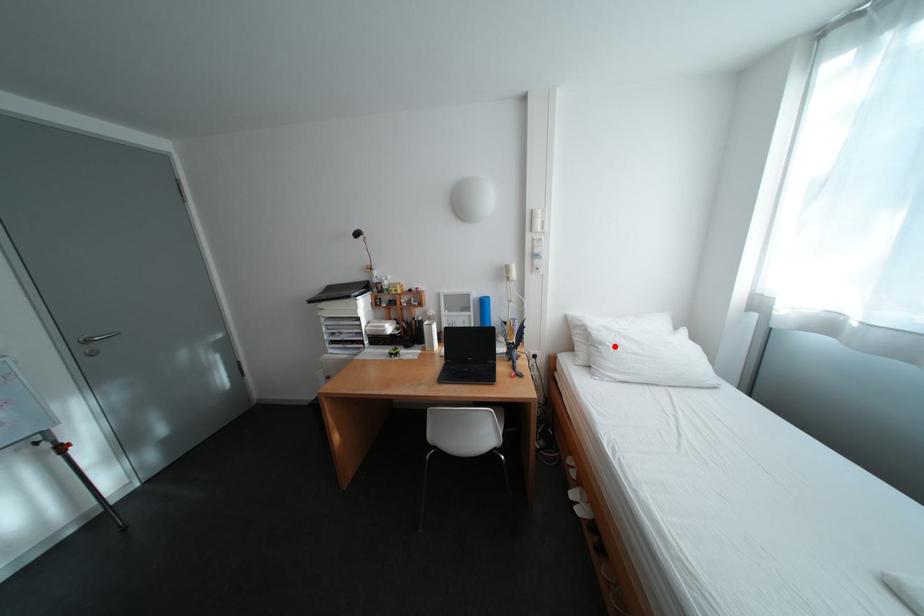
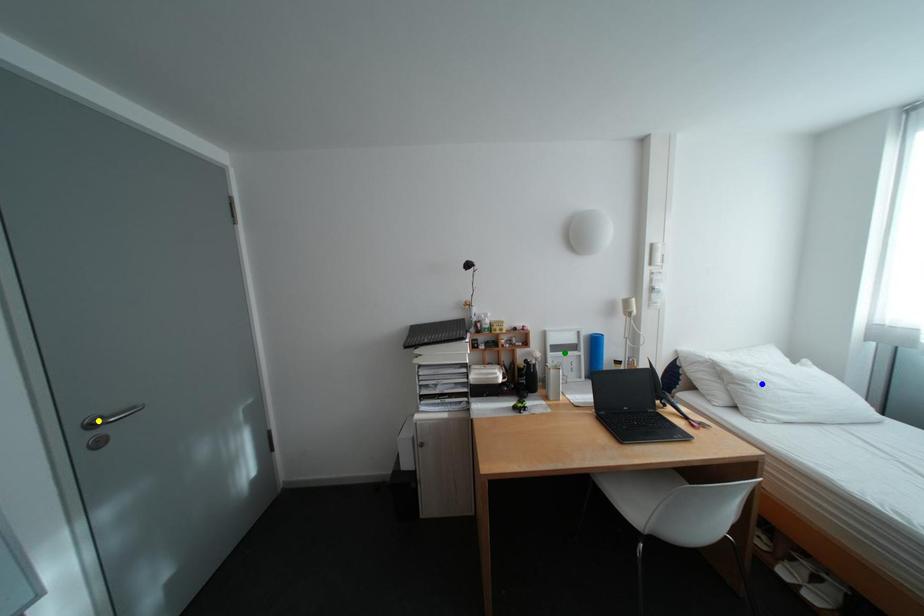
Question: I am providing you with two images of the same scene from different viewpoints. A red point is marked on the first image. You are given multiple points on the second image. Which mark in image 2 goes with the point in image 1?

Choices:
 (A) yellow point
 (B) blue point
 (C) green point

Answer: (B)